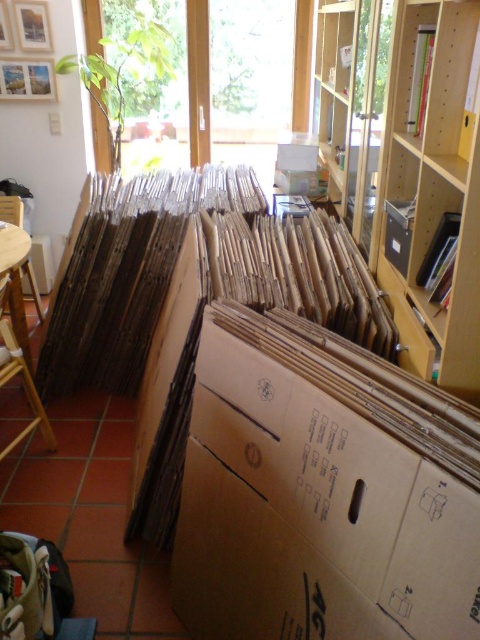
Who is higher up, brown cardboard box at center or wooden bookshelf at center?

Positioned higher is wooden bookshelf at center.

Consider the image. Is brown cardboard box at center wider than wooden bookshelf at center?

Correct, the width of brown cardboard box at center exceeds that of wooden bookshelf at center.

Is point (429, 424) behind point (411, 342)?

No.

This screenshot has width=480, height=640. Find the location of `brown cardboard box at center`. brown cardboard box at center is located at coordinates (323, 492).